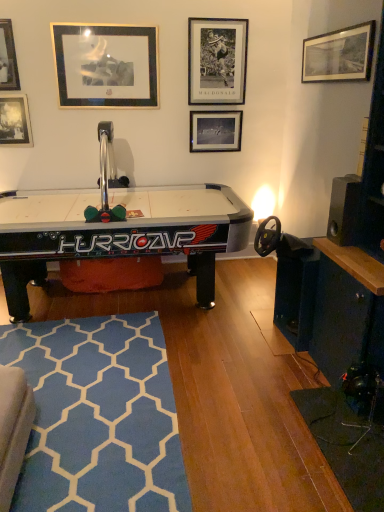
Question: Can you confirm if black glossy air hockey table at center is positioned to the right of black matte picture frame at center, which ranks as the third picture frame in right-to-left order?

Choices:
 (A) no
 (B) yes

Answer: (A)

Question: From a real-world perspective, is black glossy air hockey table at center positioned over black matte picture frame at center, marked as the fourth picture frame in a left-to-right arrangement, based on gravity?

Choices:
 (A) yes
 (B) no

Answer: (B)

Question: Is black glossy air hockey table at center next to black matte picture frame at center, marked as the fourth picture frame in a left-to-right arrangement, and touching it?

Choices:
 (A) no
 (B) yes

Answer: (A)

Question: From the image's perspective, does black glossy air hockey table at center appear lower than black matte picture frame at center, marked as the fourth picture frame in a left-to-right arrangement?

Choices:
 (A) no
 (B) yes

Answer: (B)

Question: From a real-world perspective, is black glossy air hockey table at center positioned under black matte picture frame at center, marked as the fourth picture frame in a left-to-right arrangement, based on gravity?

Choices:
 (A) no
 (B) yes

Answer: (B)

Question: Considering the positions of metallic silver picture frame at upper left, marked as the fifth picture frame in a right-to-left arrangement, and gold/metallic picture frame at upper left, the third picture frame from the left, in the image, is metallic silver picture frame at upper left, marked as the fifth picture frame in a right-to-left arrangement, wider or thinner than gold/metallic picture frame at upper left, the third picture frame from the left,?

Choices:
 (A) thin
 (B) wide

Answer: (B)

Question: From the image's perspective, is metallic silver picture frame at upper left, positioned as the 2th picture frame in left-to-right order, located above or below gold/metallic picture frame at upper left, the third picture frame from the left?

Choices:
 (A) below
 (B) above

Answer: (B)

Question: Looking at the image, does metallic silver picture frame at upper left, positioned as the 2th picture frame in left-to-right order, seem bigger or smaller compared to gold/metallic picture frame at upper left, which is the 4th picture frame in right-to-left order?

Choices:
 (A) big
 (B) small

Answer: (B)

Question: Is metallic silver picture frame at upper left, positioned as the 2th picture frame in left-to-right order, spatially inside gold/metallic picture frame at upper left, the third picture frame from the left, or outside of it?

Choices:
 (A) outside
 (B) inside

Answer: (A)

Question: Would you say metallic silver picture frame at upper center, placed as the 2th picture frame when sorted from right to left, is to the left or to the right of black matte picture frame at center, which ranks as the third picture frame in right-to-left order, in the picture?

Choices:
 (A) right
 (B) left

Answer: (A)

Question: In the image, is metallic silver picture frame at upper center, placed as the 5th picture frame when sorted from left to right, positioned in front of or behind black matte picture frame at center, marked as the fourth picture frame in a left-to-right arrangement?

Choices:
 (A) behind
 (B) front

Answer: (B)

Question: Is point (231, 20) positioned closer to the camera than point (210, 113)?

Choices:
 (A) farther
 (B) closer

Answer: (B)

Question: Do you think metallic silver picture frame at upper center, placed as the 2th picture frame when sorted from right to left, is within black matte picture frame at center, which ranks as the third picture frame in right-to-left order, or outside of it?

Choices:
 (A) outside
 (B) inside

Answer: (A)

Question: Is point (213, 37) positioned closer to the camera than point (24, 464)?

Choices:
 (A) farther
 (B) closer

Answer: (A)

Question: In terms of size, does metallic silver picture frame at upper center, placed as the 5th picture frame when sorted from left to right, appear bigger or smaller than blue textured rug at lower left?

Choices:
 (A) small
 (B) big

Answer: (A)